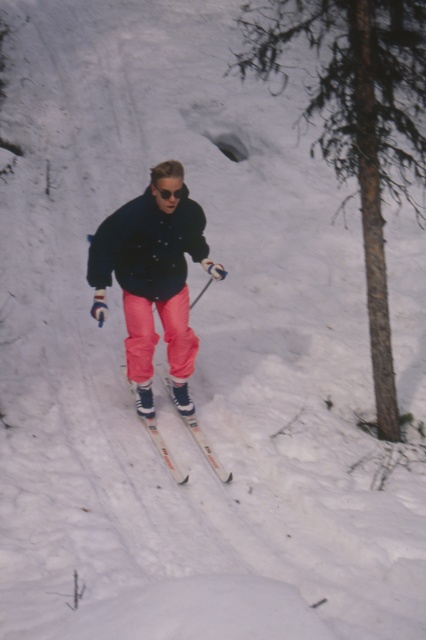
Question: Which of the following is the farthest from the observer?

Choices:
 (A) white plastic ski at center
 (B) sunglasses at center
 (C) matte black jacket at center

Answer: (A)

Question: Based on their relative distances, which object is nearer to the brown rough tree trunk at center right?

Choices:
 (A) white plastic ski at center
 (B) sunglasses at center

Answer: (B)

Question: Is matte black jacket at center further to camera compared to sunglasses at center?

Choices:
 (A) yes
 (B) no

Answer: (B)

Question: Can you confirm if brown rough tree trunk at center right is bigger than matte black jacket at center?

Choices:
 (A) yes
 (B) no

Answer: (A)

Question: In this image, where is brown rough tree trunk at center right located relative to matte black jacket at center?

Choices:
 (A) right
 (B) left

Answer: (A)

Question: Which point appears closest to the camera in this image?

Choices:
 (A) (94, 260)
 (B) (169, 454)

Answer: (A)